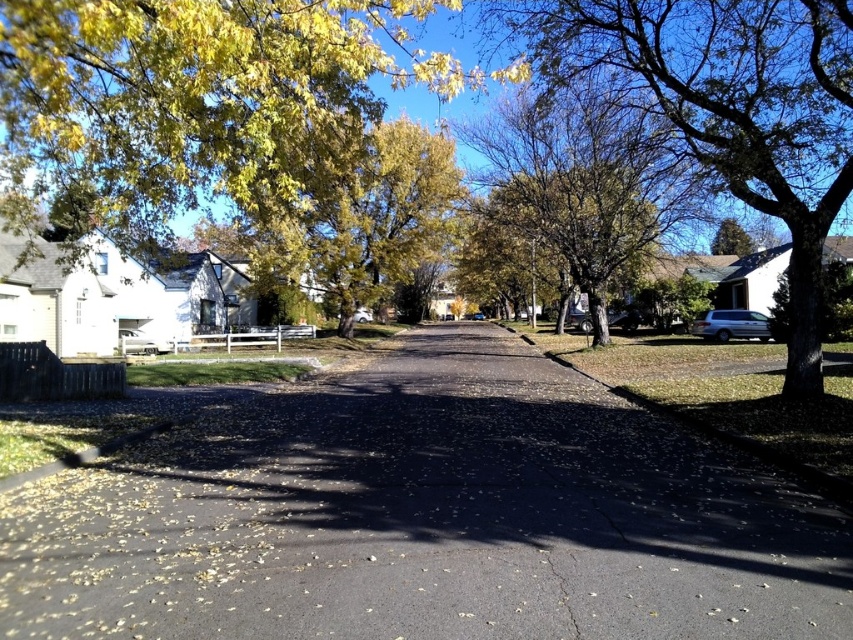
You are standing at the center of the residential street and want to walk straight ahead. Where will your path lead you? Please answer based on the asphalt at center.

The asphalt at center is located at point [427,518], so walking straight ahead from the center will lead you towards that direction.

Looking at this image, you are a pedestrian standing on the sidewalk and want to cross the road to reach the green leafy tree at right. Which direction should you walk to first reach the asphalt at center before proceeding to the tree?

You should walk towards the asphalt at center first since it is closer to you than the green leafy tree at right. Once you reach the asphalt at center, you can then proceed towards the green leafy tree at right.